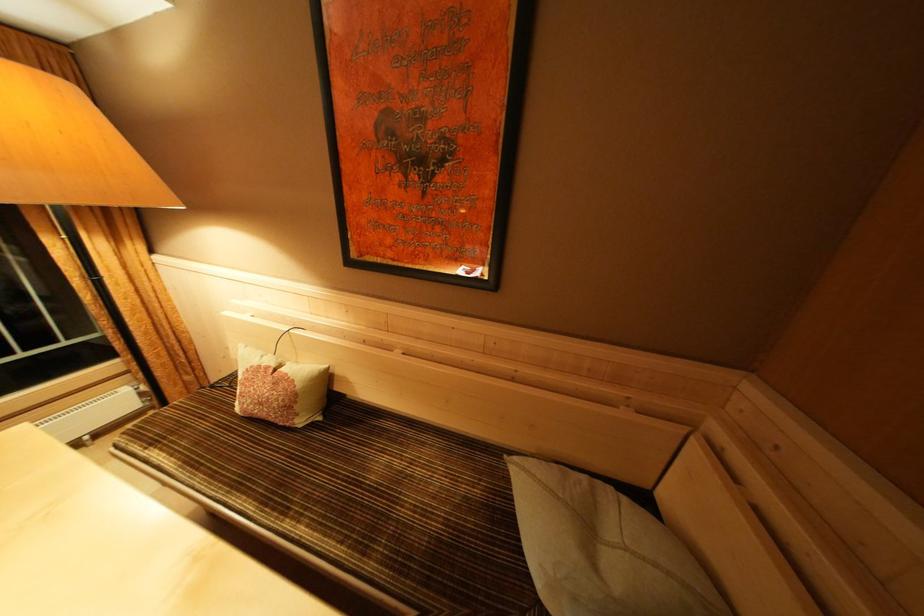
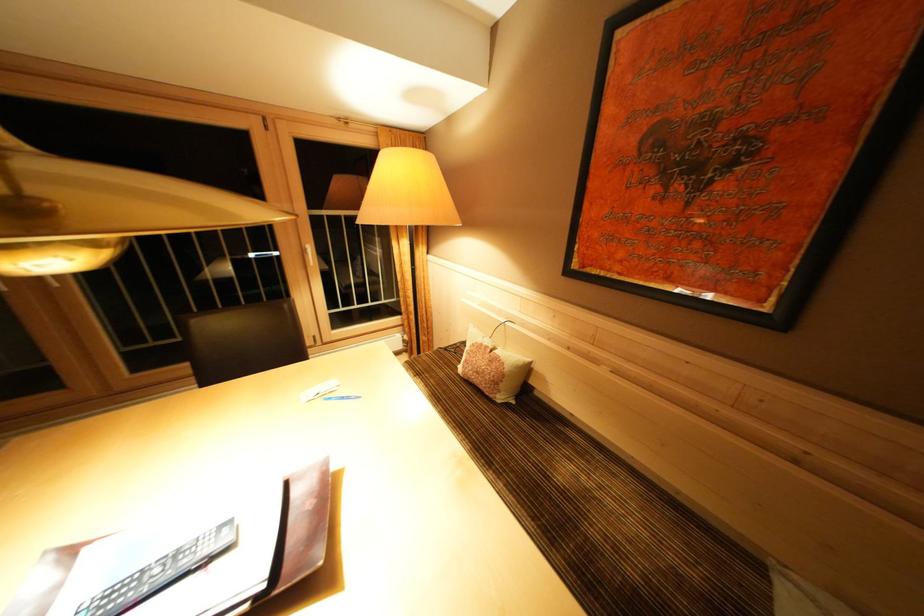
Locate, in the second image, the point that corresponds to (x=274, y=373) in the first image.

(493, 352)